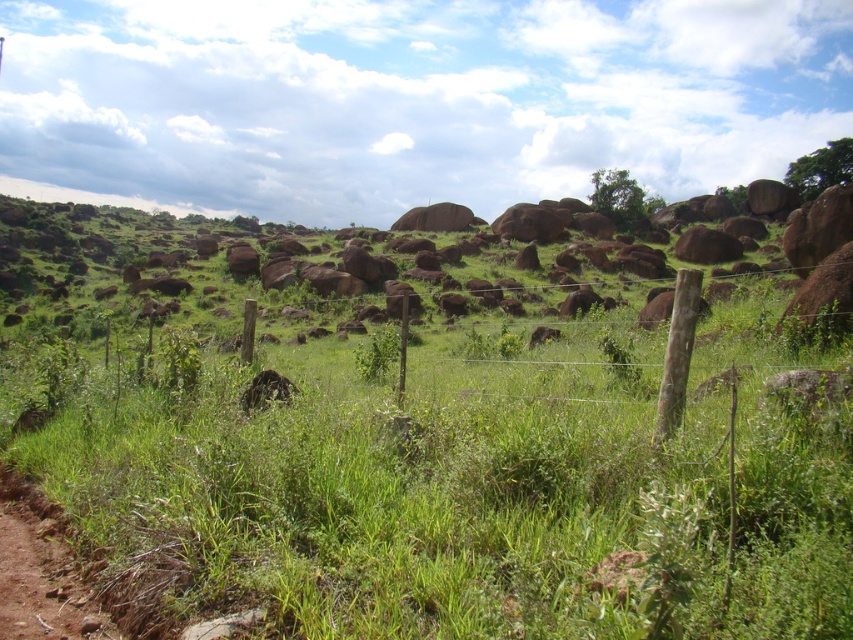
You are standing in the rural landscape and see the green grassy at center and the brown fuzzy animal at center. Which one is nearer to you?

Result: The green grassy at center is closer to the viewer than the brown fuzzy animal at center.

You are a hiker who wants to take a photo of the brown fuzzy animal at center without stepping on the green grassy at center. Can you stand behind the wire fence and still get a clear shot?

The green grassy at center is positioned over the brown fuzzy animal at center, so standing behind the wire fence might block your view of the animal since the grass is covering it. You might need to find another angle where the grass isn

You are a hiker who wants to take a photo of the brown fuzzy animal at center and the green grassy at center. Based on their positions, which object should you focus on first if you are moving from left to right across the scene?

Since the green grassy at center is to the right of the brown fuzzy animal at center, you should focus on the brown fuzzy animal at center first as you move from left to right.